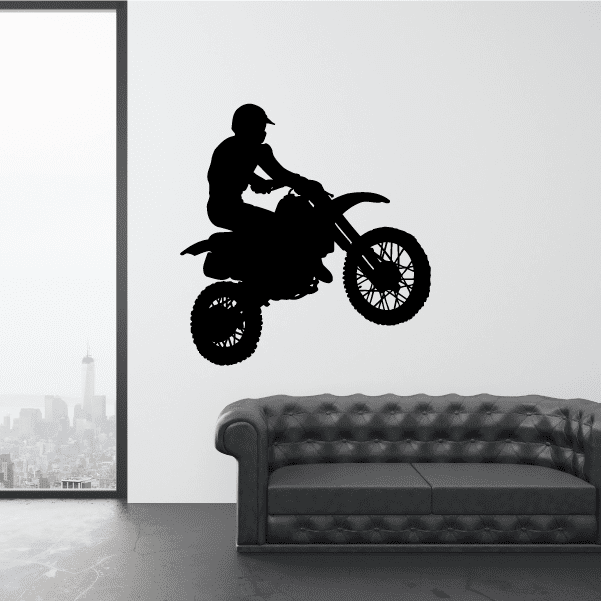
This screenshot has height=601, width=601. Identify the location of floor. (85, 561).